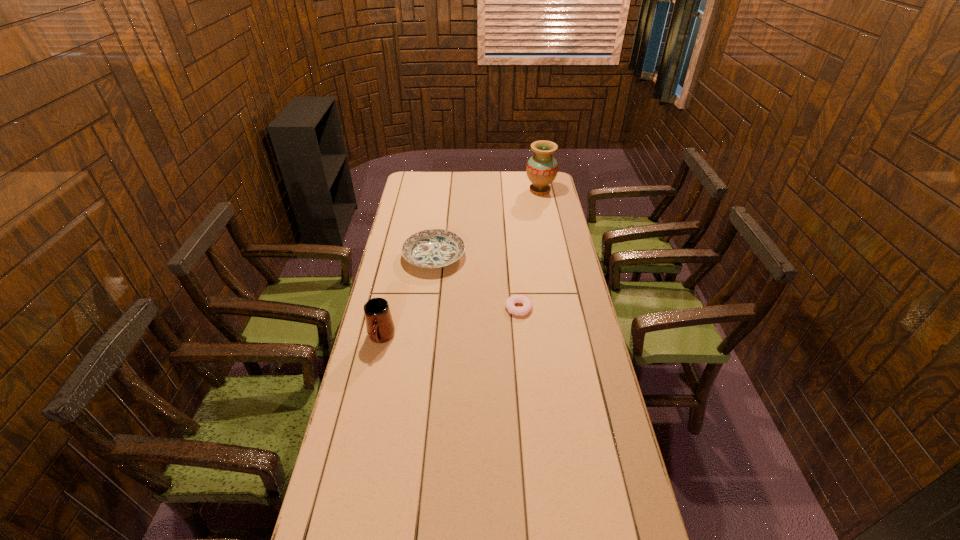
Identify which object is the second closest to the plate. Please provide its 2D coordinates. Your answer should be formatted as a tuple, i.e. [(x, y)], where the tuple contains the x and y coordinates of a point satisfying the conditions above.

[(380, 327)]

Image resolution: width=960 pixels, height=540 pixels. I want to click on object that is the closest one to the doughnut, so click(433, 248).

The height and width of the screenshot is (540, 960). Find the location of `vacant space that satisfies the following two spatial constraints: 1. on the front side of the third farthest object; 2. on the left side of the second shortest object`. vacant space that satisfies the following two spatial constraints: 1. on the front side of the third farthest object; 2. on the left side of the second shortest object is located at coordinates (427, 308).

The width and height of the screenshot is (960, 540). In order to click on free space that satisfies the following two spatial constraints: 1. on the back side of the rightmost object; 2. on the right side of the doughnut in this screenshot , I will do `click(508, 190)`.